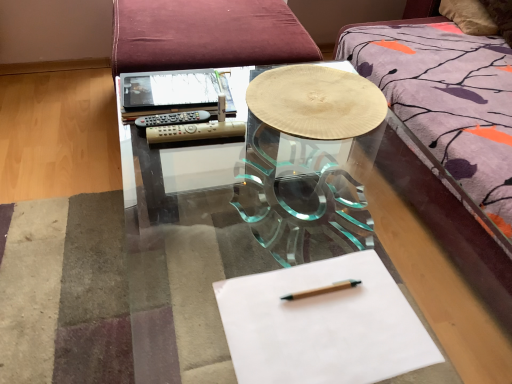
Locate an element on the screen. The image size is (512, 384). blank space to the left of wooden pencil at center is located at coordinates (261, 303).